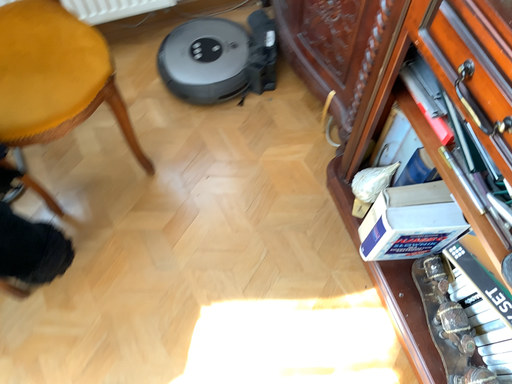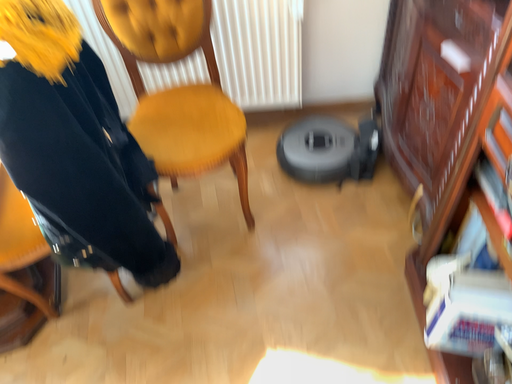
Question: How did the camera likely rotate when shooting the video?

Choices:
 (A) rotated right
 (B) rotated left

Answer: (B)